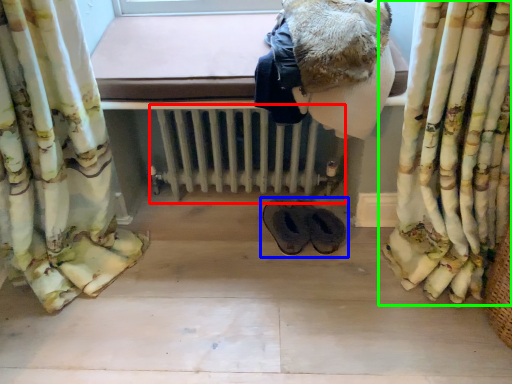
Question: Which is nearer to the radiator (highlighted by a red box)? footwear (highlighted by a blue box) or curtain (highlighted by a green box).

Choices:
 (A) footwear
 (B) curtain

Answer: (A)